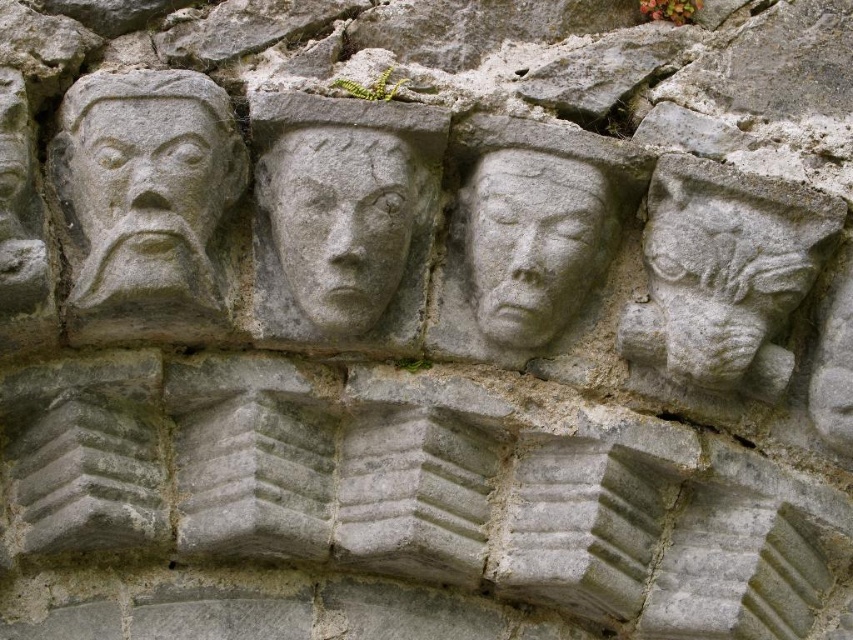
Question: In this image, where is gray stone face at left located relative to gray stone carving at center?

Choices:
 (A) left
 (B) right

Answer: (A)

Question: Among these objects, which one is farthest from the camera?

Choices:
 (A) stone carved face at right
 (B) gray stone face at center
 (C) gray stone face at left
 (D) gray stone carving at center

Answer: (D)

Question: Can you confirm if gray stone face at left is smaller than gray stone face at center?

Choices:
 (A) no
 (B) yes

Answer: (A)

Question: Which is farther from the stone carved face at right?

Choices:
 (A) gray stone face at left
 (B) gray stone face at center
 (C) gray stone carving at center

Answer: (A)

Question: Estimate the real-world distances between objects in this image. Which object is closer to the stone carved face at right?

Choices:
 (A) gray stone face at left
 (B) gray stone carving at center
 (C) gray stone face at center

Answer: (B)

Question: Does gray stone face at center have a lesser width compared to gray stone carving at center?

Choices:
 (A) no
 (B) yes

Answer: (A)